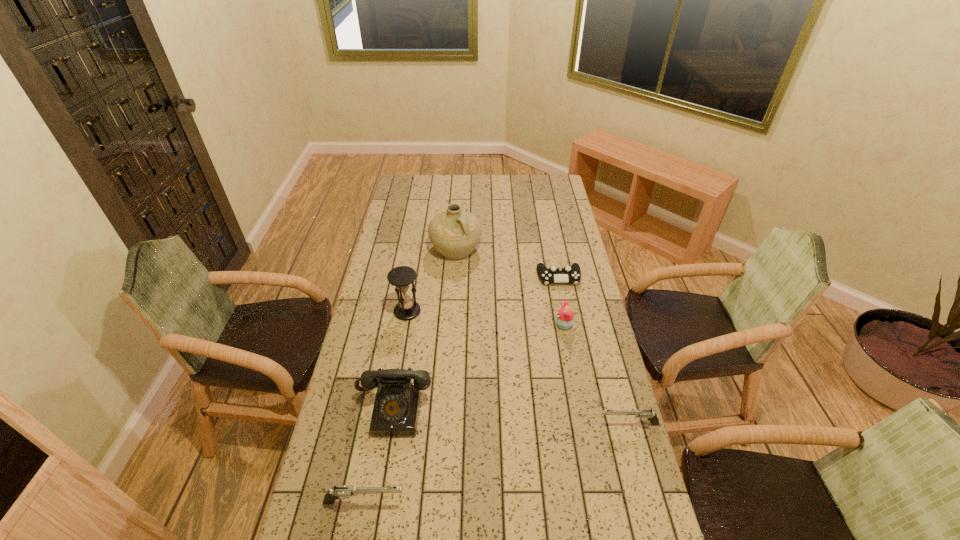
This screenshot has width=960, height=540. I want to click on the nearest object, so click(343, 491).

The height and width of the screenshot is (540, 960). I want to click on the taller pistol, so click(x=343, y=491).

What are the coordinates of `the shorter pistol` in the screenshot? It's located at (644, 415).

I want to click on the farther pistol, so click(644, 415).

Where is `pottery`? The height and width of the screenshot is (540, 960). pottery is located at coordinates (455, 233).

The image size is (960, 540). I want to click on the farthest object, so 455,233.

Identify the location of cupcake. The image size is (960, 540). (564, 319).

Find the location of a particular element. the sixth shortest object is located at coordinates (401, 277).

Find the location of `the sixth nearest object`. the sixth nearest object is located at coordinates (568, 274).

Find the location of a particular element. The image size is (960, 540). telephone is located at coordinates (396, 408).